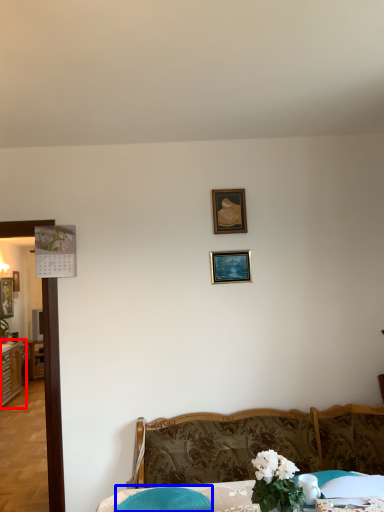
Question: Which object is closer to the camera taking this photo, dresser (highlighted by a red box) or swivel chair (highlighted by a blue box)?

Choices:
 (A) dresser
 (B) swivel chair

Answer: (B)